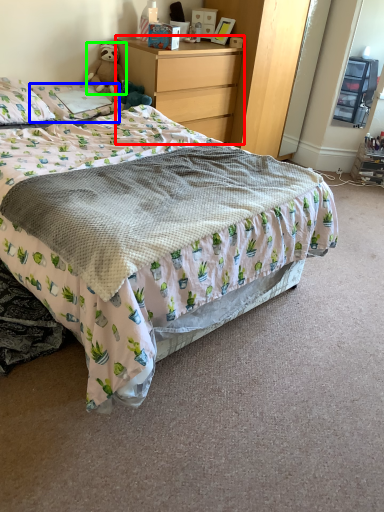
Question: Considering the real-world distances, which object is farthest from chest of drawers (highlighted by a red box)? pillow (highlighted by a blue box) or teddy bear (highlighted by a green box)?

Choices:
 (A) pillow
 (B) teddy bear

Answer: (A)